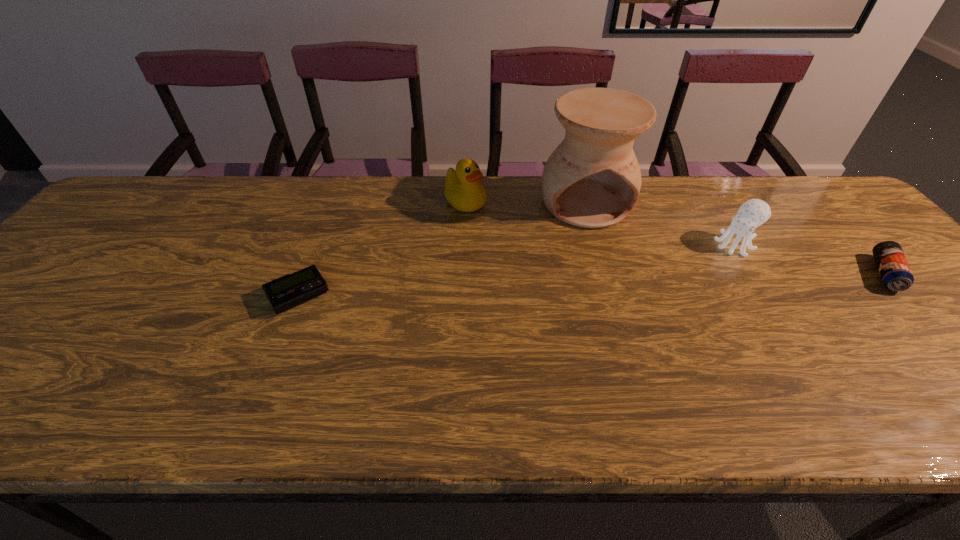
Select which object appears as the third closest to the leftmost object. Please provide its 2D coordinates. Your answer should be formatted as a tuple, i.e. [(x, y)], where the tuple contains the x and y coordinates of a point satisfying the conditions above.

[(753, 213)]

Where is `free space that satisfies the following two spatial constraints: 1. on the back side of the beeper; 2. on the right side of the third tallest object`? Image resolution: width=960 pixels, height=540 pixels. free space that satisfies the following two spatial constraints: 1. on the back side of the beeper; 2. on the right side of the third tallest object is located at coordinates (319, 245).

The height and width of the screenshot is (540, 960). Identify the location of free spot that satisfies the following two spatial constraints: 1. on the back side of the octopus; 2. on the right side of the beeper. (319, 245).

Where is `vacant area that satisfies the following two spatial constraints: 1. on the back side of the octopus; 2. on the left side of the beeper`? The image size is (960, 540). vacant area that satisfies the following two spatial constraints: 1. on the back side of the octopus; 2. on the left side of the beeper is located at coordinates (319, 245).